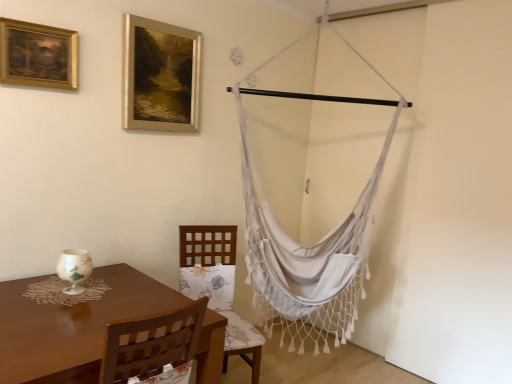
Question: Is the position of gold metallic picture frame at upper center, placed as the first picture frame when sorted from right to left, more distant than that of brown wooden table at lower left?

Choices:
 (A) yes
 (B) no

Answer: (A)

Question: Considering the relative sizes of gold metallic picture frame at upper center, which appears as the 1th picture frame when viewed from the back, and brown wooden table at lower left in the image provided, is gold metallic picture frame at upper center, which appears as the 1th picture frame when viewed from the back, wider than brown wooden table at lower left?

Choices:
 (A) no
 (B) yes

Answer: (A)

Question: Is gold metallic picture frame at upper center, which appears as the 1th picture frame when viewed from the back, facing away from brown wooden table at lower left?

Choices:
 (A) no
 (B) yes

Answer: (A)

Question: Is gold metallic picture frame at upper center, which ranks as the second picture frame in left-to-right order, not inside brown wooden table at lower left?

Choices:
 (A) no
 (B) yes

Answer: (B)

Question: Does gold metallic picture frame at upper center, which is counted as the second picture frame, starting from the front, have a lesser height compared to brown wooden table at lower left?

Choices:
 (A) yes
 (B) no

Answer: (A)

Question: Considering the relative positions of brown wooden table at lower left and woodenchair at center in the image provided, is brown wooden table at lower left to the left or to the right of woodenchair at center?

Choices:
 (A) left
 (B) right

Answer: (A)

Question: From a real-world perspective, is brown wooden table at lower left positioned above or below woodenchair at center?

Choices:
 (A) below
 (B) above

Answer: (A)

Question: Considering the positions of point (176, 292) and point (206, 249), is point (176, 292) closer or farther from the camera than point (206, 249)?

Choices:
 (A) farther
 (B) closer

Answer: (B)

Question: Looking at the image, does brown wooden table at lower left seem bigger or smaller compared to woodenchair at center?

Choices:
 (A) small
 (B) big

Answer: (B)

Question: Is gold metallic picture frame at upper center, which ranks as the second picture frame in left-to-right order, in front of or behind white macrame hammock at right in the image?

Choices:
 (A) behind
 (B) front

Answer: (B)

Question: Looking at their shapes, would you say gold metallic picture frame at upper center, which appears as the 1th picture frame when viewed from the back, is wider or thinner than white macrame hammock at right?

Choices:
 (A) wide
 (B) thin

Answer: (B)

Question: Is gold metallic picture frame at upper center, which is counted as the second picture frame, starting from the front, spatially inside white macrame hammock at right, or outside of it?

Choices:
 (A) inside
 (B) outside

Answer: (B)

Question: Is point (125, 110) closer or farther from the camera than point (246, 244)?

Choices:
 (A) farther
 (B) closer

Answer: (B)

Question: Based on their positions, is woodenchair at center located to the left or right of gold metallic picture frame at upper center, which appears as the 1th picture frame when viewed from the back?

Choices:
 (A) left
 (B) right

Answer: (B)

Question: Considering their positions, is woodenchair at center located in front of or behind gold metallic picture frame at upper center, which appears as the 1th picture frame when viewed from the back?

Choices:
 (A) behind
 (B) front

Answer: (B)